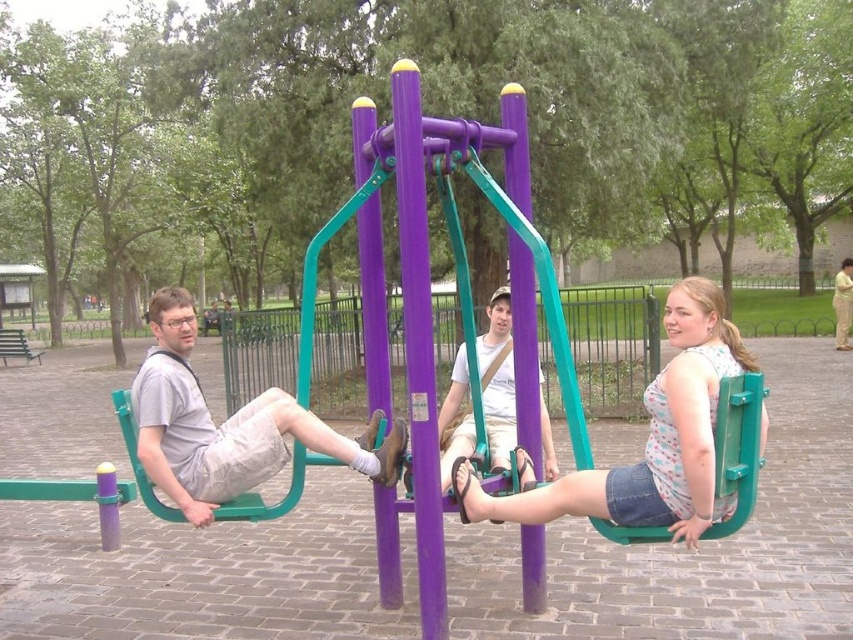
Does denim shorts at center come in front of matte gray shorts at left?

Yes.

Does denim shorts at center appear on the left side of matte gray shorts at left?

Incorrect, denim shorts at center is not on the left side of matte gray shorts at left.

Where is `denim shorts at center`? denim shorts at center is located at coordinates (648, 440).

Locate an element on the screen. The width and height of the screenshot is (853, 640). denim shorts at center is located at coordinates (648, 440).